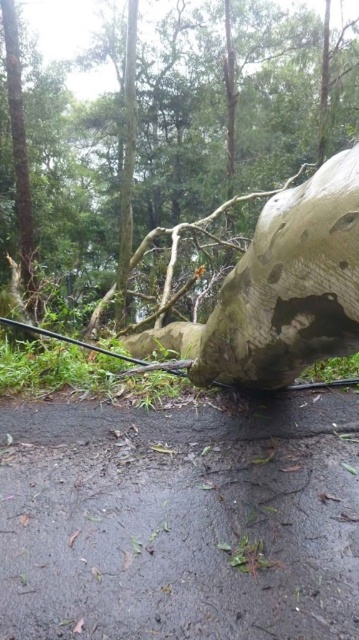
You are a hiker trying to cross the road blocked by the green rough bark tree at center and the green rough bark at left. Which object is bigger and might block your path more?

The green rough bark tree at center is larger in size compared to the green rough bark at left, so it might block your path more.